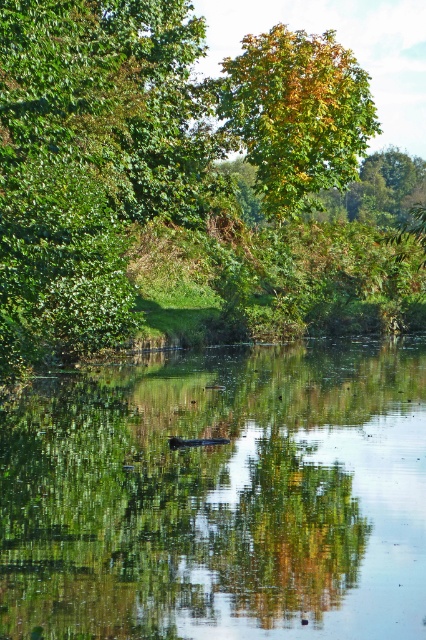
Is green leafy tree at center taller than green reflective water at center?

Indeed, green leafy tree at center has a greater height compared to green reflective water at center.

Who is taller, green leafy tree at center or green reflective water at center?

green leafy tree at center

You are a GUI agent. You are given a task and a screenshot of the screen. Output one action in this format:
    pyautogui.click(x=<x>, y=<y>)
    Task: Click on the green leafy tree at center
    This screenshot has height=640, width=426.
    Given the screenshot: What is the action you would take?
    pyautogui.click(x=190, y=179)

Identify the location of green leafy tree at center. The width and height of the screenshot is (426, 640). tap(190, 179).

Is point (192, 518) farther from camera compared to point (285, 216)?

That is False.

Find the location of `green reflective water at center`. green reflective water at center is located at coordinates (218, 497).

Does green leafy tree at center have a larger size compared to yellow-green leafy tree at upper center?

Yes, green leafy tree at center is bigger than yellow-green leafy tree at upper center.

Does green leafy tree at center have a lesser height compared to yellow-green leafy tree at upper center?

No, green leafy tree at center is not shorter than yellow-green leafy tree at upper center.

Does point (189, 33) come in front of point (294, 106)?

No, (189, 33) is further to viewer.

Locate an element on the screen. green leafy tree at center is located at coordinates click(x=190, y=179).